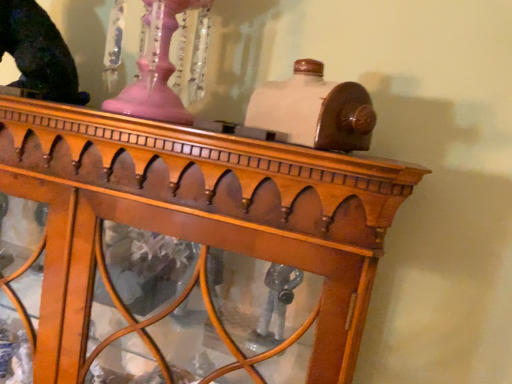
What do you see at coordinates (39, 53) in the screenshot?
I see `shiny black statue at upper left` at bounding box center [39, 53].

Locate an element on the screen. shiny black statue at upper left is located at coordinates (39, 53).

Where is `wooden table at center`? This screenshot has height=384, width=512. wooden table at center is located at coordinates (197, 218).

The width and height of the screenshot is (512, 384). What do you see at coordinates (197, 218) in the screenshot?
I see `wooden table at center` at bounding box center [197, 218].

Locate an element on the screen. The image size is (512, 384). shiny black statue at upper left is located at coordinates (39, 53).

Considering the relative positions of wooden table at center and shiny black statue at upper left in the image provided, is wooden table at center to the left of shiny black statue at upper left from the viewer's perspective?

No.

In the image, is wooden table at center positioned in front of or behind shiny black statue at upper left?

In the image, wooden table at center appears in front of shiny black statue at upper left.

Considering the points (27, 133) and (30, 35), which point is behind, point (27, 133) or point (30, 35)?

The point (30, 35) is farther from the camera.

From the image's perspective, relative to shiny black statue at upper left, is wooden table at center above or below?

From the image's perspective, wooden table at center appears below shiny black statue at upper left.

From a real-world perspective, who is located lower, wooden table at center or shiny black statue at upper left?

In real-world perspective, wooden table at center is lower.

Can you confirm if wooden table at center is thinner than shiny black statue at upper left?

In fact, wooden table at center might be wider than shiny black statue at upper left.

Between wooden table at center and shiny black statue at upper left, which one has more height?

wooden table at center.

Can you confirm if wooden table at center is smaller than shiny black statue at upper left?

Incorrect, wooden table at center is not smaller in size than shiny black statue at upper left.

Is wooden table at center surrounding shiny black statue at upper left?

No, shiny black statue at upper left is not surrounded by wooden table at center.

Are wooden table at center and shiny black statue at upper left far apart?

No, wooden table at center is not far away from shiny black statue at upper left.

Is wooden table at center looking in the opposite direction of shiny black statue at upper left?

No, wooden table at center is not facing away from shiny black statue at upper left.

How many degrees apart are the facing directions of wooden table at center and shiny black statue at upper left?

They differ by 0.709 degrees in their facing directions.

Where is `furniture that appears below the shiny black statue at upper left (from a real-world perspective)`? This screenshot has height=384, width=512. furniture that appears below the shiny black statue at upper left (from a real-world perspective) is located at coordinates (197, 218).

Between shiny black statue at upper left and wooden table at center, which one appears on the right side from the viewer's perspective?

wooden table at center.

Does shiny black statue at upper left come in front of wooden table at center?

That is False.

Does point (64, 63) come in front of point (191, 223)?

No, (64, 63) is further to viewer.

Based on the photo, from the image's perspective, is shiny black statue at upper left above or below wooden table at center?

shiny black statue at upper left is situated higher than wooden table at center in the image.

From a real-world perspective, is shiny black statue at upper left above or below wooden table at center?

In terms of real-world spatial position, shiny black statue at upper left is above wooden table at center.

Considering the relative sizes of shiny black statue at upper left and wooden table at center in the image provided, is shiny black statue at upper left wider than wooden table at center?

No.

Looking at this image, considering the sizes of objects shiny black statue at upper left and wooden table at center in the image provided, who is taller, shiny black statue at upper left or wooden table at center?

wooden table at center.

Based on their sizes in the image, would you say shiny black statue at upper left is bigger or smaller than wooden table at center?

shiny black statue at upper left is smaller than wooden table at center.

In the scene shown: Would you say wooden table at center is part of shiny black statue at upper left's contents?

No, wooden table at center is not a part of shiny black statue at upper left.

Are shiny black statue at upper left and wooden table at center located far from each other?

No.

Does shiny black statue at upper left turn towards wooden table at center?

No, shiny black statue at upper left is not oriented towards wooden table at center.

How much distance is there between shiny black statue at upper left and wooden table at center?

shiny black statue at upper left is 14.74 inches from wooden table at center.

Where is `animal that appears above the wooden table at center (from a real-world perspective)`? The width and height of the screenshot is (512, 384). animal that appears above the wooden table at center (from a real-world perspective) is located at coordinates tap(39, 53).

Locate an element on the screen. This screenshot has width=512, height=384. animal that appears above the wooden table at center (from the image's perspective) is located at coordinates (39, 53).

The width and height of the screenshot is (512, 384). What are the coordinates of `furniture that is in front of the shiny black statue at upper left` in the screenshot? It's located at (197, 218).